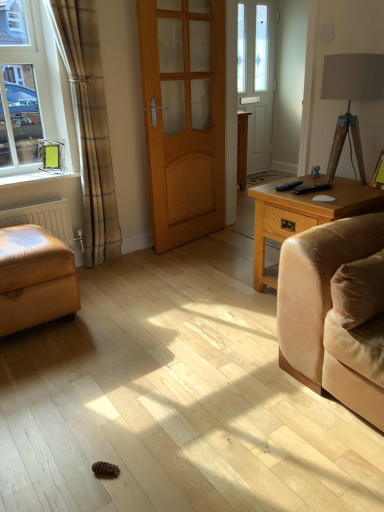
What do you see at coordinates (351, 98) in the screenshot? This screenshot has width=384, height=512. I see `matte gray lampshade at upper right` at bounding box center [351, 98].

Locate an element on the screen. The height and width of the screenshot is (512, 384). plaid fabric curtain at left is located at coordinates (89, 125).

Where is `suede cushion at right`? Image resolution: width=384 pixels, height=512 pixels. suede cushion at right is located at coordinates (358, 290).

You are a GUI agent. You are given a task and a screenshot of the screen. Output one action in this format:
    pyautogui.click(x=<x>, y=<y>)
    Task: Click on the leather armchair at left
    The width and height of the screenshot is (384, 512).
    Given the screenshot: What is the action you would take?
    pyautogui.click(x=35, y=278)

The image size is (384, 512). Describe the element at coordinates (36, 177) in the screenshot. I see `white plastic window sill at left` at that location.

Locate an element on the screen. matte wood cabinet at center is located at coordinates (242, 148).

Image resolution: width=384 pixels, height=512 pixels. I want to click on wooden door at center, so [184, 116].

Considering the positions of point (11, 252) and point (246, 139), is point (11, 252) closer or farther from the camera than point (246, 139)?

Point (11, 252) appears to be closer to the viewer than point (246, 139).

Can you confirm if leather armchair at left is wider than matte wood cabinet at center?

Yes, leather armchair at left is wider than matte wood cabinet at center.

Where is `armchair that is on the left side of matte wood cabinet at center`? This screenshot has height=512, width=384. armchair that is on the left side of matte wood cabinet at center is located at coordinates (35, 278).

Considering the relative positions of leather armchair at left and matte wood cabinet at center in the image provided, is leather armchair at left behind matte wood cabinet at center?

No, leather armchair at left is closer to the viewer.

From the image's perspective, between white matte radiator at lower left and white plastic window sill at left, who is located below?

white matte radiator at lower left is shown below in the image.

In the scene shown: Is white matte radiator at lower left aimed at white plastic window sill at left?

No, white matte radiator at lower left is not turned towards white plastic window sill at left.

Based on the photo, from a real-world perspective, is white matte radiator at lower left positioned above or below white plastic window sill at left?

From a real-world perspective, white matte radiator at lower left is physically below white plastic window sill at left.

Which is closer, (64, 237) or (6, 185)?

Point (64, 237).

Based on their sizes in the image, would you say matte wood cabinet at center is bigger or smaller than leather armchair at left?

matte wood cabinet at center is smaller than leather armchair at left.

Measure the distance from matte wood cabinet at center to leather armchair at left.

They are 6.63 feet apart.

From the image's perspective, which is below, matte wood cabinet at center or leather armchair at left?

leather armchair at left appears lower in the image.

Is matte wood cabinet at center beside leather armchair at left?

No, matte wood cabinet at center is not beside leather armchair at left.

Which object is more forward, suede cushion at right or plaid fabric curtain at left?

suede cushion at right.

Is the surface of suede cushion at right in direct contact with plaid fabric curtain at left?

No, suede cushion at right is not next to plaid fabric curtain at left.

How different are the orientations of suede cushion at right and plaid fabric curtain at left in degrees?

There is a 0.721-degree angle between the facing directions of suede cushion at right and plaid fabric curtain at left.

Between point (348, 179) and point (335, 304), which one is positioned in front?

The point (335, 304) is in front.

Is light brown wooden side table at right to the left of suede cushion at right from the viewer's perspective?

No, light brown wooden side table at right is not to the left of suede cushion at right.

From a real-world perspective, is light brown wooden side table at right physically below suede cushion at right?

Yes, from a real-world perspective, light brown wooden side table at right is below suede cushion at right.

Is plaid fabric curtain at left further to the viewer compared to wooden door at center?

No, plaid fabric curtain at left is in front of wooden door at center.

Is plaid fabric curtain at left oriented towards wooden door at center?

No, plaid fabric curtain at left is not aimed at wooden door at center.

Would you consider plaid fabric curtain at left to be distant from wooden door at center?

plaid fabric curtain at left is actually quite close to wooden door at center.

From the picture: From a real-world perspective, is plaid fabric curtain at left under wooden door at center?

Yes, from a real-world perspective, plaid fabric curtain at left is under wooden door at center.

From a real-world perspective, who is located higher, light brown wooden side table at right or leather armchair at left?

In real-world perspective, light brown wooden side table at right is above.

Are light brown wooden side table at right and leather armchair at left beside each other?

No, light brown wooden side table at right is not with leather armchair at left.

Is light brown wooden side table at right in front of leather armchair at left?

No, light brown wooden side table at right is behind leather armchair at left.

From the image's perspective, which object appears higher, light brown wooden side table at right or leather armchair at left?

From the image's view, light brown wooden side table at right is above.

You are a GUI agent. You are given a task and a screenshot of the screen. Output one action in this format:
    pyautogui.click(x=<x>, y=<y>)
    Task: Click on the cabinetry on the right of leather armchair at left
    
    Given the screenshot: What is the action you would take?
    pyautogui.click(x=242, y=148)

Locate an element on the screen. Image resolution: width=384 pixels, height=512 pixels. radiator in front of the white plastic window sill at left is located at coordinates (43, 218).

Which object lies further to the anchor point plaid fabric curtain at left, matte wood cabinet at center or white plastic window sill at left?

matte wood cabinet at center.

From the image, which object appears to be nearer to suede cushion at right, plaid fabric curtain at left or matte gray lampshade at upper right?

The object closer to suede cushion at right is matte gray lampshade at upper right.

In the scene shown: From the image, which object appears to be farther from suede cushion at right, matte gray lampshade at upper right or white plastic window sill at left?

Based on the image, white plastic window sill at left appears to be further to suede cushion at right.

Estimate the real-world distances between objects in this image. Which object is further from light brown wooden side table at right, matte wood cabinet at center or matte gray lampshade at upper right?

Based on the image, matte wood cabinet at center appears to be further to light brown wooden side table at right.

Which object lies further to the anchor point leather armchair at left, white plastic window sill at left or suede cushion at right?

suede cushion at right.

In the scene shown: Estimate the real-world distances between objects in this image. Which object is further from white plastic window sill at left, wooden door at center or light brown wooden side table at right?

light brown wooden side table at right is positioned further to the anchor white plastic window sill at left.

When comparing their distances from white matte radiator at lower left, does leather armchair at left or white plastic window sill at left seem closer?

Among the two, white plastic window sill at left is located nearer to white matte radiator at lower left.

From the image, which object appears to be nearer to white plastic window sill at left, plaid fabric curtain at left or light brown wooden side table at right?

plaid fabric curtain at left.

At what (x,y) coordinates should I click in order to perform the action: click on radiator situated between white plastic window sill at left and matte gray lampshade at upper right from left to right. Please return your answer as a coordinate pair (x, y). This screenshot has height=512, width=384. Looking at the image, I should click on (43, 218).

Where is `table between matte gray lampshade at upper right and suede cushion at right in the vertical direction`? Image resolution: width=384 pixels, height=512 pixels. table between matte gray lampshade at upper right and suede cushion at right in the vertical direction is located at coordinates (302, 216).

Where is `door located between white plastic window sill at left and suede cushion at right in the left-right direction`? The width and height of the screenshot is (384, 512). door located between white plastic window sill at left and suede cushion at right in the left-right direction is located at coordinates (184, 116).

Identify the location of pillow between white plastic window sill at left and matte gray lampshade at upper right in the horizontal direction. (358, 290).